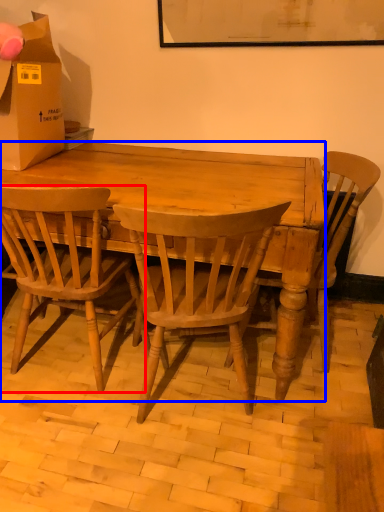
Question: Which object is further to the camera taking this photo, chair (highlighted by a red box) or desk (highlighted by a blue box)?

Choices:
 (A) chair
 (B) desk

Answer: (B)